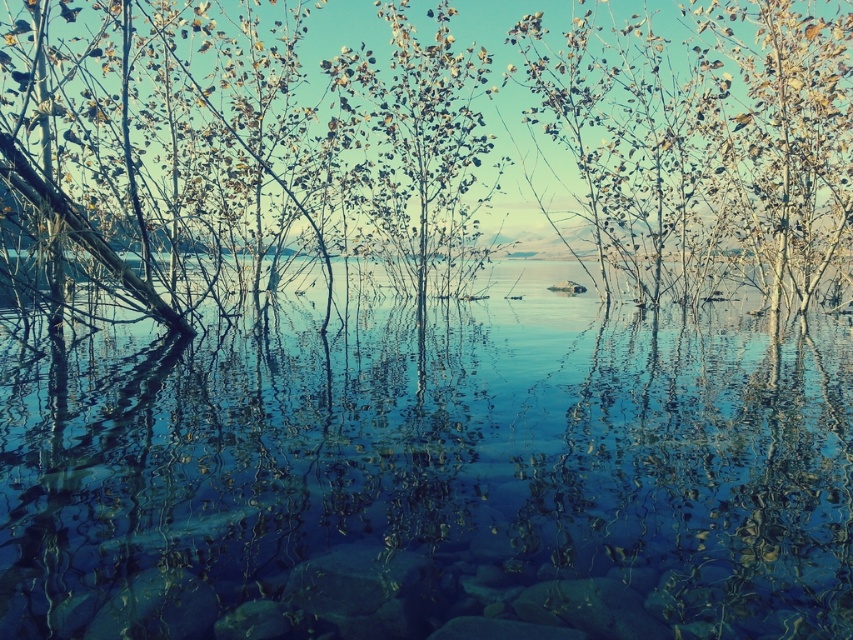
Based on the photo, can you confirm if clear glass water at center is smaller than green leafy tree at center?

Yes, clear glass water at center is smaller than green leafy tree at center.

You are a GUI agent. You are given a task and a screenshot of the screen. Output one action in this format:
    pyautogui.click(x=<x>, y=<y>)
    Task: Click on the clear glass water at center
    Image resolution: width=853 pixels, height=640 pixels.
    Given the screenshot: What is the action you would take?
    pyautogui.click(x=432, y=474)